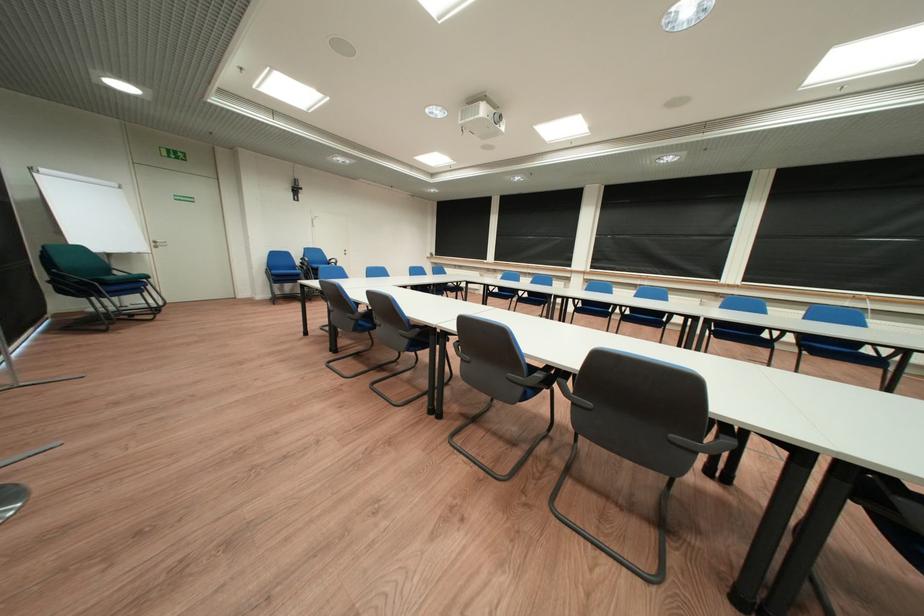
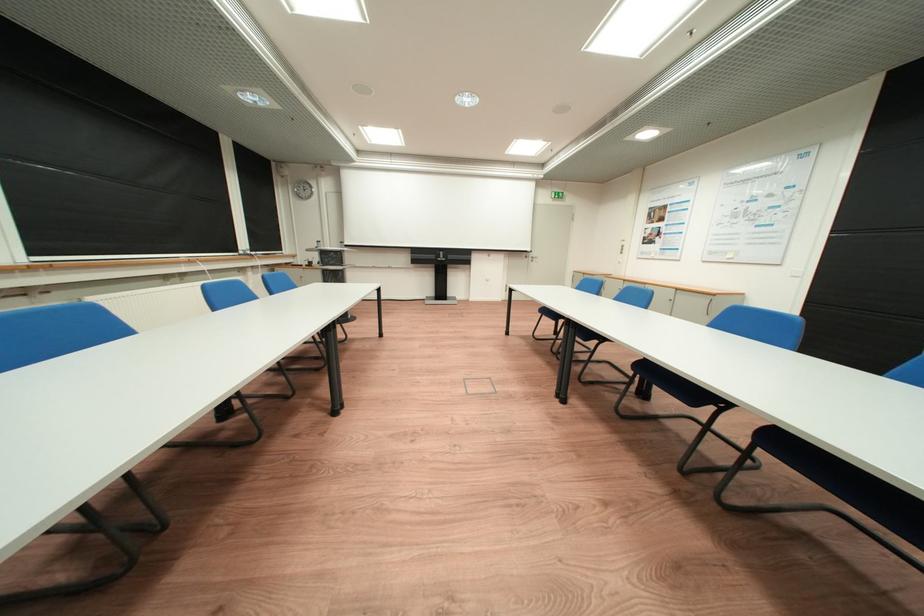
Question: I am providing you with two images of the same scene from different viewpoints. Which of the following objects are not visible in image2?

Choices:
 (A) blue chair sitting surface
 (B) door handle
 (C) colorful propeller cap
 (D) black chair armrest

Answer: (D)